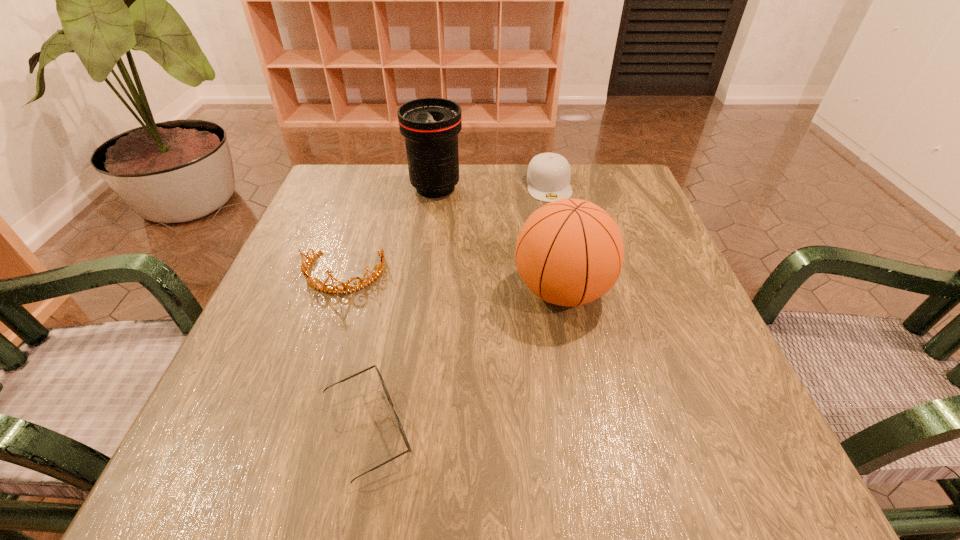
Find the location of `vacant space at the far left corner of the desktop`. vacant space at the far left corner of the desktop is located at coordinates (343, 187).

In the image, there is a desktop. Identify the location of vacant space at the far right corner. (637, 199).

Where is `vacant area between the spectacles and the basketball`? This screenshot has width=960, height=540. vacant area between the spectacles and the basketball is located at coordinates (465, 361).

You are a GUI agent. You are given a task and a screenshot of the screen. Output one action in this format:
    pyautogui.click(x=<x>, y=<y>)
    Task: Click on the vacant region between the telephoto lens and the nearest object
    This screenshot has width=960, height=540.
    Given the screenshot: What is the action you would take?
    pyautogui.click(x=401, y=309)

I want to click on free space between the tiara and the telephoto lens, so click(390, 231).

Where is `free space between the basketball and the telephoto lens`? This screenshot has height=540, width=960. free space between the basketball and the telephoto lens is located at coordinates (499, 239).

In order to click on vacant area that lies between the basketball and the shortest object in this screenshot , I will do `click(465, 361)`.

The width and height of the screenshot is (960, 540). What are the coordinates of `vacant space that is in between the basketball and the tiara` in the screenshot? It's located at (453, 282).

You are a GUI agent. You are given a task and a screenshot of the screen. Output one action in this format:
    pyautogui.click(x=<x>, y=<y>)
    Task: Click on the free space that is in between the basketball and the tiara
    The image size is (960, 540).
    Given the screenshot: What is the action you would take?
    453,282

Locate an element on the screen. The width and height of the screenshot is (960, 540). vacant space that's between the cap and the tiara is located at coordinates (446, 229).